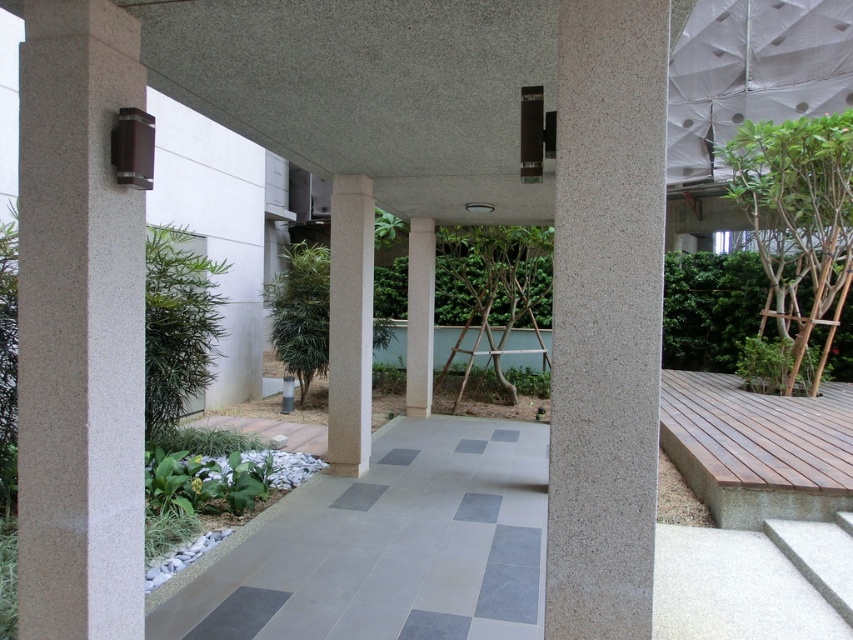
Question: Which point is closer to the camera?

Choices:
 (A) green matte tree at center
 (B) granite pillar at center
 (C) gray tile path at center

Answer: (B)

Question: Which object appears closest to the camera in this image?

Choices:
 (A) granite pillar at center
 (B) green matte tree at center
 (C) sanded concrete pillar at left
 (D) green leafy tree at right

Answer: (A)

Question: Does granite pillar at center appear under green leafy tree at right?

Choices:
 (A) yes
 (B) no

Answer: (A)

Question: Is granite pillar at center further to the viewer compared to green leafy tree at right?

Choices:
 (A) yes
 (B) no

Answer: (B)

Question: Which point is farther to the camera?

Choices:
 (A) white polished concrete pillar at center
 (B) gray tile path at center

Answer: (A)

Question: Does granite pillar at center appear under green leafy tree at right?

Choices:
 (A) yes
 (B) no

Answer: (A)